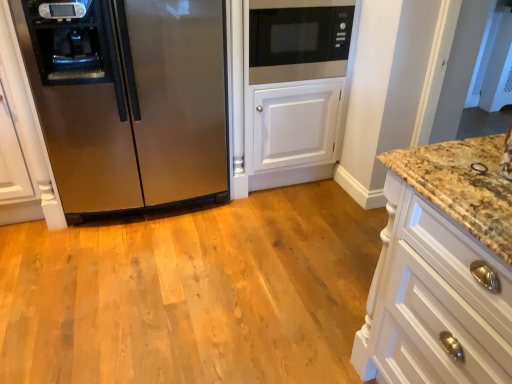
Question: Is stainless steel refrigerator at left positioned behind white wood cabinet at right?

Choices:
 (A) yes
 (B) no

Answer: (A)

Question: Considering the relative sizes of stainless steel refrigerator at left and white wood cabinet at right in the image provided, is stainless steel refrigerator at left wider than white wood cabinet at right?

Choices:
 (A) yes
 (B) no

Answer: (B)

Question: Is white wood cabinet at right completely or partially inside stainless steel refrigerator at left?

Choices:
 (A) no
 (B) yes

Answer: (A)

Question: Does stainless steel refrigerator at left come in front of white wood cabinet at right?

Choices:
 (A) no
 (B) yes

Answer: (A)

Question: Is stainless steel refrigerator at left oriented away from white wood cabinet at right?

Choices:
 (A) yes
 (B) no

Answer: (B)

Question: Based on their positions, is black matte microwave at upper center located to the left or right of white wood cabinet at right?

Choices:
 (A) right
 (B) left

Answer: (B)

Question: Is point (257, 56) closer or farther from the camera than point (387, 332)?

Choices:
 (A) closer
 (B) farther

Answer: (B)

Question: Do you think black matte microwave at upper center is within white wood cabinet at right, or outside of it?

Choices:
 (A) inside
 (B) outside

Answer: (B)

Question: From a real-world perspective, is black matte microwave at upper center above or below white wood cabinet at right?

Choices:
 (A) below
 (B) above

Answer: (B)

Question: From the image's perspective, is white wood cabinet at right positioned above or below stainless steel refrigerator at left?

Choices:
 (A) above
 (B) below

Answer: (B)

Question: From a real-world perspective, is white wood cabinet at right above or below stainless steel refrigerator at left?

Choices:
 (A) above
 (B) below

Answer: (B)

Question: Based on their positions, is white wood cabinet at right located to the left or right of stainless steel refrigerator at left?

Choices:
 (A) right
 (B) left

Answer: (A)

Question: Considering the positions of white wood cabinet at right and stainless steel refrigerator at left in the image, is white wood cabinet at right taller or shorter than stainless steel refrigerator at left?

Choices:
 (A) tall
 (B) short

Answer: (B)

Question: Considering the positions of stainless steel refrigerator at left and black matte microwave at upper center in the image, is stainless steel refrigerator at left wider or thinner than black matte microwave at upper center?

Choices:
 (A) wide
 (B) thin

Answer: (A)

Question: Relative to black matte microwave at upper center, is stainless steel refrigerator at left in front or behind?

Choices:
 (A) behind
 (B) front

Answer: (B)